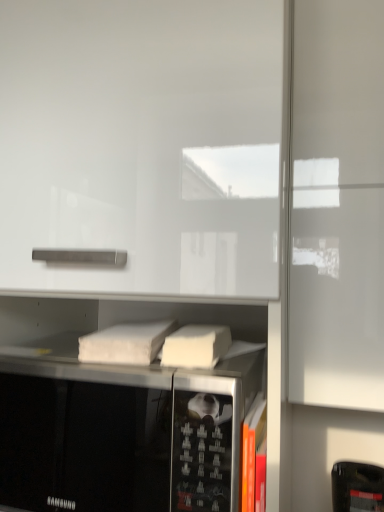
Question: Considering the relative positions of orange matte book at lower right, which ranks as the first book in right-to-left order, and black matte microwave oven at center in the image provided, is orange matte book at lower right, which ranks as the first book in right-to-left order, to the left or to the right of black matte microwave oven at center?

Choices:
 (A) right
 (B) left

Answer: (A)

Question: From a real-world perspective, relative to black matte microwave oven at center, is orange matte book at lower right, which is the 1th book from front to back, vertically above or below?

Choices:
 (A) above
 (B) below

Answer: (B)

Question: Estimate the real-world distances between objects in this image. Which object is farther from the white matte book at center, marked as the 1th book in a back-to-front arrangement?

Choices:
 (A) orange matte book at lower right, which ranks as the first book in right-to-left order
 (B) black matte microwave oven at center

Answer: (A)

Question: Considering the real-world distances, which object is closest to the orange matte book at lower right, the first book in the bottom-to-top sequence?

Choices:
 (A) black matte microwave oven at center
 (B) white matte book at center, which is the 2th book from right to left

Answer: (A)